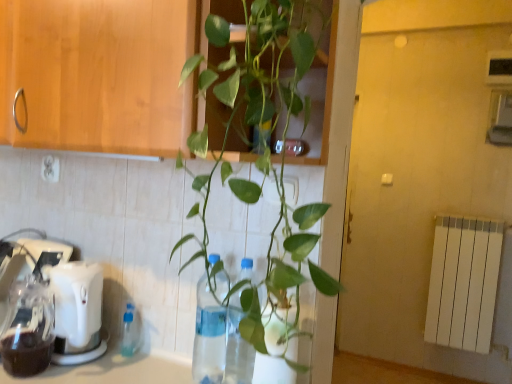
Question: Is the depth of white plastic mixer at lower left less than that of transparent plastic bottle at center?

Choices:
 (A) yes
 (B) no

Answer: (B)

Question: Considering the relative sizes of white plastic mixer at lower left and transparent plastic bottle at center in the image provided, is white plastic mixer at lower left thinner than transparent plastic bottle at center?

Choices:
 (A) yes
 (B) no

Answer: (B)

Question: From a real-world perspective, is white plastic mixer at lower left beneath transparent plastic bottle at center?

Choices:
 (A) no
 (B) yes

Answer: (B)

Question: Is white plastic mixer at lower left smaller than transparent plastic bottle at center?

Choices:
 (A) no
 (B) yes

Answer: (A)

Question: Considering the relative sizes of white plastic mixer at lower left and transparent plastic bottle at center in the image provided, is white plastic mixer at lower left bigger than transparent plastic bottle at center?

Choices:
 (A) yes
 (B) no

Answer: (A)

Question: Is point (26, 240) positioned closer to the camera than point (212, 304)?

Choices:
 (A) farther
 (B) closer

Answer: (A)

Question: Is white plastic mixer at lower left situated inside clear plastic bottle at center, the second bottle positioned from the back, or outside?

Choices:
 (A) outside
 (B) inside

Answer: (A)

Question: From a real-world perspective, is white plastic mixer at lower left positioned above or below clear plastic bottle at center, the second bottle positioned from the back?

Choices:
 (A) above
 (B) below

Answer: (B)

Question: In the image, is white plastic mixer at lower left positioned in front of or behind clear plastic bottle at center, which appears as the second bottle when viewed from the left?

Choices:
 (A) front
 (B) behind

Answer: (B)

Question: Is point (195, 377) positioned closer to the camera than point (238, 334)?

Choices:
 (A) farther
 (B) closer

Answer: (A)

Question: Considering the relative positions of clear plastic bottle at center, positioned as the 1th bottle in front-to-back order, and transparent plastic bottle at center in the image provided, is clear plastic bottle at center, positioned as the 1th bottle in front-to-back order, to the left or to the right of transparent plastic bottle at center?

Choices:
 (A) left
 (B) right

Answer: (A)

Question: From a real-world perspective, is clear plastic bottle at center, which appears as the second bottle when viewed from the left, physically located above or below transparent plastic bottle at center?

Choices:
 (A) above
 (B) below

Answer: (B)

Question: In terms of size, does clear plastic bottle at center, which appears as the second bottle when viewed from the left, appear bigger or smaller than transparent plastic bottle at center?

Choices:
 (A) big
 (B) small

Answer: (B)

Question: Considering the positions of clear plastic bottle at center, which appears as the second bottle when viewed from the left, and transparent plastic bottle at lower left, positioned as the 2th bottle in front-to-back order, in the image, is clear plastic bottle at center, which appears as the second bottle when viewed from the left, bigger or smaller than transparent plastic bottle at lower left, positioned as the 2th bottle in front-to-back order,?

Choices:
 (A) big
 (B) small

Answer: (A)

Question: From the image's perspective, is clear plastic bottle at center, the 1th bottle from the right, positioned above or below transparent plastic bottle at lower left, arranged as the 2th bottle when viewed from the right?

Choices:
 (A) above
 (B) below

Answer: (A)